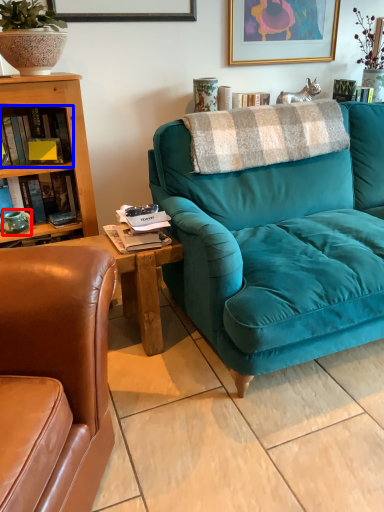
Question: Which of the following is the closest to the observer, teal (highlighted by a red box) or book (highlighted by a blue box)?

Choices:
 (A) teal
 (B) book

Answer: (B)